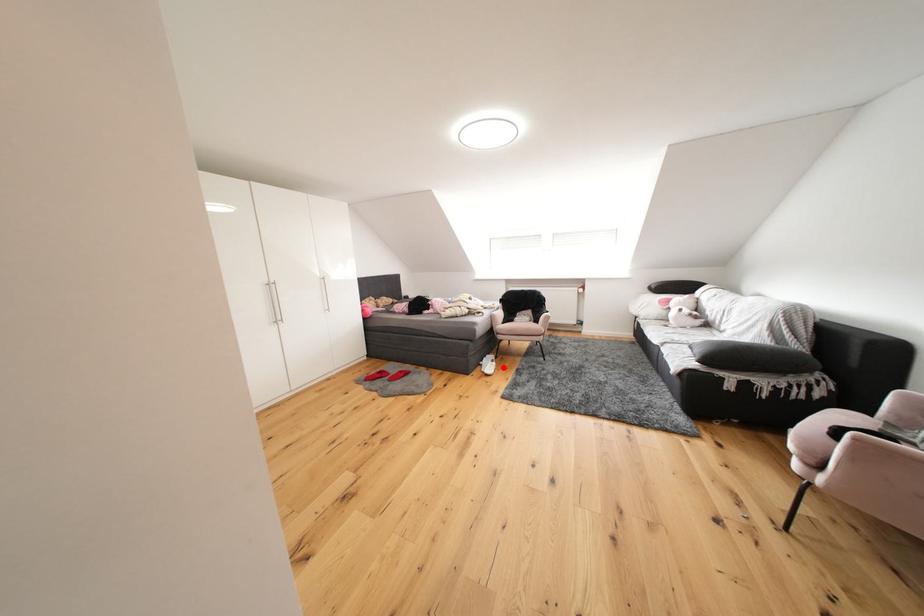
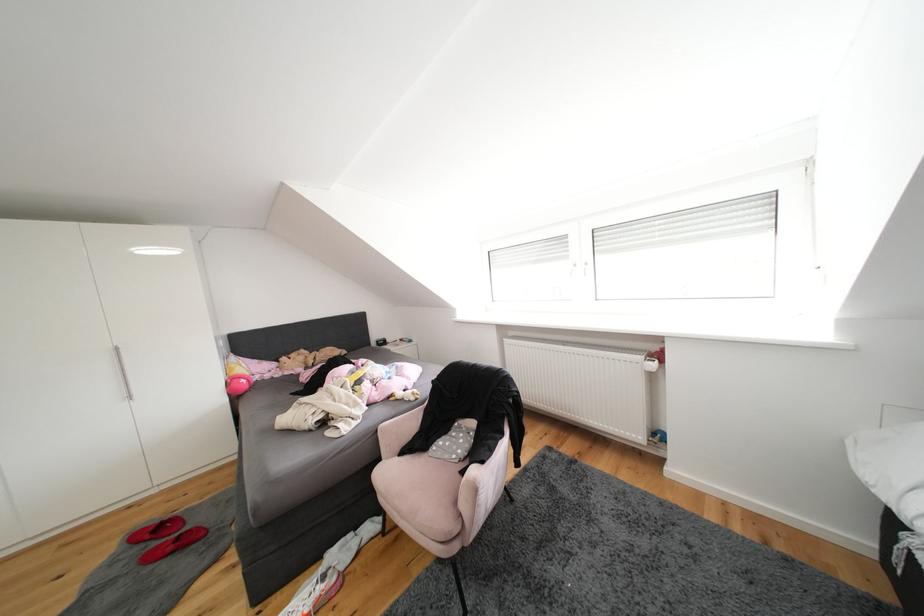
Question: I am providing you with two images of the same scene from different viewpoints. Given a red point in image1, look at the same physical point in image2. Is it:

Choices:
 (A) Closer to the viewpoint
 (B) Farther from the viewpoint

Answer: (B)